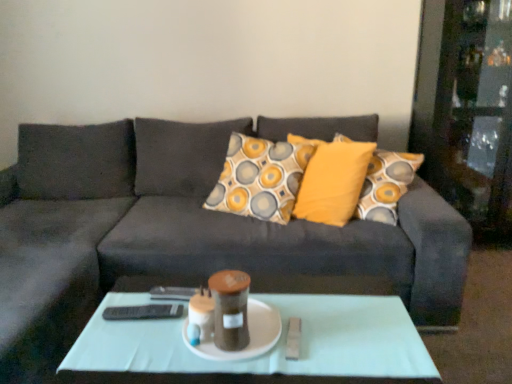
The width and height of the screenshot is (512, 384). What do you see at coordinates (143, 312) in the screenshot?
I see `black plastic remote at center` at bounding box center [143, 312].

This screenshot has width=512, height=384. Describe the element at coordinates (249, 335) in the screenshot. I see `white ceramic plate at center` at that location.

Where is `light green glass coffee table at center`? The width and height of the screenshot is (512, 384). light green glass coffee table at center is located at coordinates (264, 354).

Is black plastic remote at center turned away from dark gray fabric couch at center?

Yes, black plastic remote at center is positioned with its back facing dark gray fabric couch at center.

Considering the positions of objects black plastic remote at center and dark gray fabric couch at center in the image provided, who is more to the right, black plastic remote at center or dark gray fabric couch at center?

dark gray fabric couch at center is more to the right.

From the image's perspective, is black plastic remote at center above or below dark gray fabric couch at center?

black plastic remote at center is below dark gray fabric couch at center.

Does dark gray fabric couch at center appear on the left side of black plastic remote at center?

Incorrect, dark gray fabric couch at center is not on the left side of black plastic remote at center.

How much distance is there between dark gray fabric couch at center and black plastic remote at center?

They are 34.41 inches apart.

Between dark gray fabric couch at center and black plastic remote at center, which one has smaller size?

Smaller between the two is black plastic remote at center.

From the image's perspective, which is above, dark gray fabric couch at center or black plastic remote at center?

dark gray fabric couch at center appears higher in the image.

Between black plastic remote at center and light green glass coffee table at center, which one has less height?

black plastic remote at center.

Considering the relative positions of black plastic remote at center and light green glass coffee table at center in the image provided, is black plastic remote at center behind light green glass coffee table at center?

Yes, the depth of black plastic remote at center is greater than that of light green glass coffee table at center.

Is black plastic remote at center facing away from light green glass coffee table at center?

That's not correct — black plastic remote at center is not looking away from light green glass coffee table at center.

From the image's perspective, is black plastic remote at center above or below light green glass coffee table at center?

Based on their image positions, black plastic remote at center is located above light green glass coffee table at center.

Measure the distance from light green glass coffee table at center to dark gray fabric couch at center.

They are 26.01 inches apart.

Which object is closer to the camera taking this photo, light green glass coffee table at center or dark gray fabric couch at center?

dark gray fabric couch at center is closer to the camera.

Based on the photo, is light green glass coffee table at center thinner than dark gray fabric couch at center?

Correct, the width of light green glass coffee table at center is less than that of dark gray fabric couch at center.

Is light green glass coffee table at center in contact with dark gray fabric couch at center?

There is a gap between light green glass coffee table at center and dark gray fabric couch at center.

Which of these two, light green glass coffee table at center or white ceramic plate at center, is thinner?

white ceramic plate at center.

How many degrees apart are the facing directions of light green glass coffee table at center and white ceramic plate at center?

There is a 0.869-degree angle between the facing directions of light green glass coffee table at center and white ceramic plate at center.

Does light green glass coffee table at center come behind white ceramic plate at center?

No.

Consider the image. Measure the distance between light green glass coffee table at center and white ceramic plate at center.

They are 5.37 inches apart.

How many degrees apart are the facing directions of white ceramic plate at center and light green glass coffee table at center?

0.869 degrees separate the facing orientations of white ceramic plate at center and light green glass coffee table at center.

Considering the relative sizes of white ceramic plate at center and light green glass coffee table at center in the image provided, is white ceramic plate at center thinner than light green glass coffee table at center?

Correct, the width of white ceramic plate at center is less than that of light green glass coffee table at center.

Considering the positions of objects white ceramic plate at center and light green glass coffee table at center in the image provided, who is more to the right, white ceramic plate at center or light green glass coffee table at center?

From the viewer's perspective, light green glass coffee table at center appears more on the right side.

Where is `glass plate below the black plastic remote at center (from a real-world perspective)`? The height and width of the screenshot is (384, 512). glass plate below the black plastic remote at center (from a real-world perspective) is located at coordinates (249, 335).

From the image's perspective, who appears lower, white ceramic plate at center or black plastic remote at center?

white ceramic plate at center.

Between point (261, 326) and point (153, 305), which one is positioned in front?

The point (261, 326) is closer to the camera.

Could you tell me if white ceramic plate at center is facing black plastic remote at center?

No, white ceramic plate at center is not oriented towards black plastic remote at center.

You are a GUI agent. You are given a task and a screenshot of the screen. Output one action in this format:
    pyautogui.click(x=<x>, y=<y>)
    Task: Click on the studio couch that appears below the black plastic remote at center (from a real-world perspective)
    
    Given the screenshot: What is the action you would take?
    pyautogui.click(x=187, y=229)

The image size is (512, 384). I want to click on studio couch that is above the black plastic remote at center (from the image's perspective), so pyautogui.click(x=187, y=229).

Based on their spatial positions, is black plastic remote at center or light green glass coffee table at center further from dark gray fabric couch at center?

Among the two, black plastic remote at center is located further to dark gray fabric couch at center.

From the picture: Considering their positions, is dark gray fabric couch at center positioned closer to light green glass coffee table at center than white ceramic plate at center?

white ceramic plate at center is closer to light green glass coffee table at center.

When comparing their distances from white ceramic plate at center, does light green glass coffee table at center or black plastic remote at center seem further?

The object further to white ceramic plate at center is black plastic remote at center.

Looking at the image, which one is located closer to dark gray fabric couch at center, light green glass coffee table at center or white ceramic plate at center?

light green glass coffee table at center.

Which object lies nearer to the anchor point black plastic remote at center, light green glass coffee table at center or dark gray fabric couch at center?

light green glass coffee table at center is closer to black plastic remote at center.

When comparing their distances from white ceramic plate at center, does black plastic remote at center or dark gray fabric couch at center seem further?

The object further to white ceramic plate at center is dark gray fabric couch at center.

Considering their positions, is light green glass coffee table at center positioned further to dark gray fabric couch at center than black plastic remote at center?

The object further to dark gray fabric couch at center is black plastic remote at center.

When comparing their distances from light green glass coffee table at center, does white ceramic plate at center or dark gray fabric couch at center seem closer?

The object closer to light green glass coffee table at center is white ceramic plate at center.

Where is `coffee table between black plastic remote at center and dark gray fabric couch at center`? coffee table between black plastic remote at center and dark gray fabric couch at center is located at coordinates (264, 354).

Find the location of `glass plate located between black plastic remote at center and light green glass coffee table at center in the left-right direction`. glass plate located between black plastic remote at center and light green glass coffee table at center in the left-right direction is located at coordinates (249, 335).

Where is `glass plate between dark gray fabric couch at center and light green glass coffee table at center from top to bottom`? The height and width of the screenshot is (384, 512). glass plate between dark gray fabric couch at center and light green glass coffee table at center from top to bottom is located at coordinates (249, 335).

Locate an element on the screen. glass plate situated between black plastic remote at center and dark gray fabric couch at center from left to right is located at coordinates [x=249, y=335].